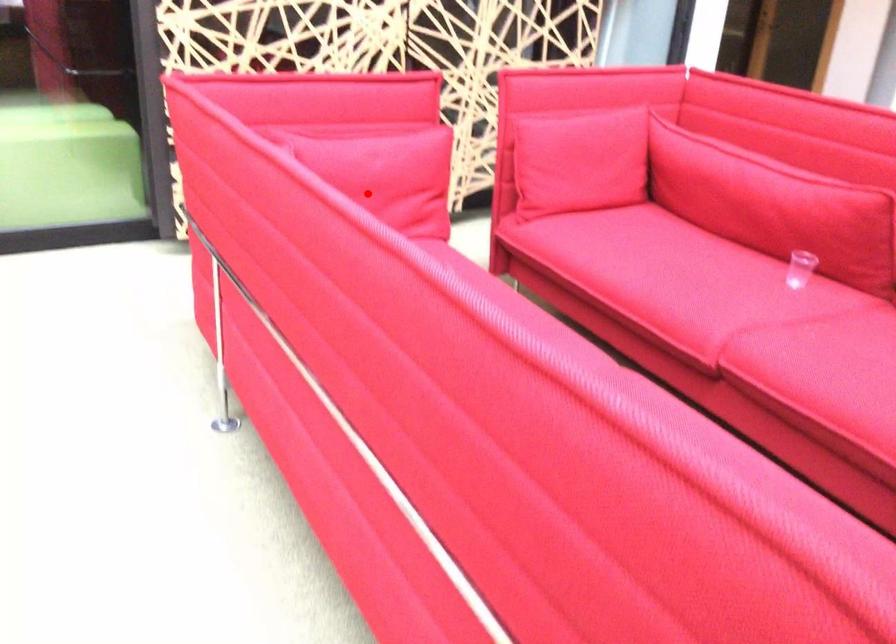
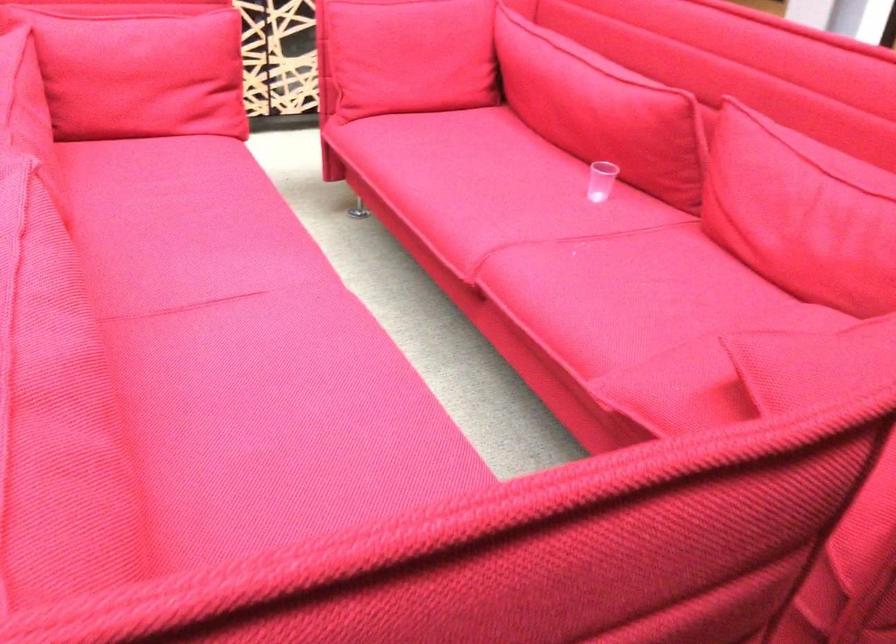
Question: I am providing you with two images of the same scene from different viewpoints. In image1, a red point is highlighted. Considering the same 3D point in image2, which of the following is correct?

Choices:
 (A) It is closer
 (B) It is farther

Answer: (A)